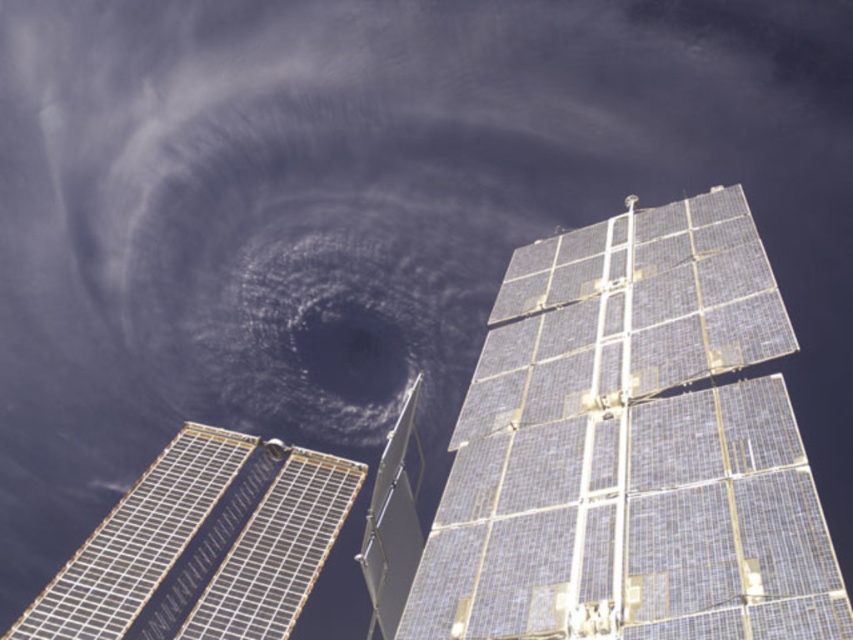
Can you confirm if blue metallic solar panel at upper right is smaller than silver metallic solar panel at lower left?

Correct, blue metallic solar panel at upper right occupies less space than silver metallic solar panel at lower left.

Is point (612, 259) closer to viewer compared to point (105, 540)?

Yes, point (612, 259) is closer to viewer.

Is point (486, 508) closer to camera compared to point (238, 616)?

Yes, point (486, 508) is in front of point (238, 616).

Locate an element on the screen. blue metallic solar panel at upper right is located at coordinates (631, 449).

Is the position of blue metallic solar panel at upper right more distant than that of dark blue/gray cloud at center?

No, it is in front of dark blue/gray cloud at center.

Is blue metallic solar panel at upper right shorter than dark blue/gray cloud at center?

Yes.

Who is more forward, (720, 433) or (387, 349)?

Point (720, 433) is in front.

Where is `blue metallic solar panel at upper right`? This screenshot has width=853, height=640. blue metallic solar panel at upper right is located at coordinates (631, 449).

Is silver metallic solar panel at lower left to the right of dark blue/gray cloud at center from the viewer's perspective?

Incorrect, silver metallic solar panel at lower left is not on the right side of dark blue/gray cloud at center.

The image size is (853, 640). In order to click on silver metallic solar panel at lower left in this screenshot , I will do `click(138, 540)`.

Is point (291, 472) positioned behind point (311, 317)?

No.

Image resolution: width=853 pixels, height=640 pixels. Identify the location of silver metallic solar panel at lower left. (138, 540).